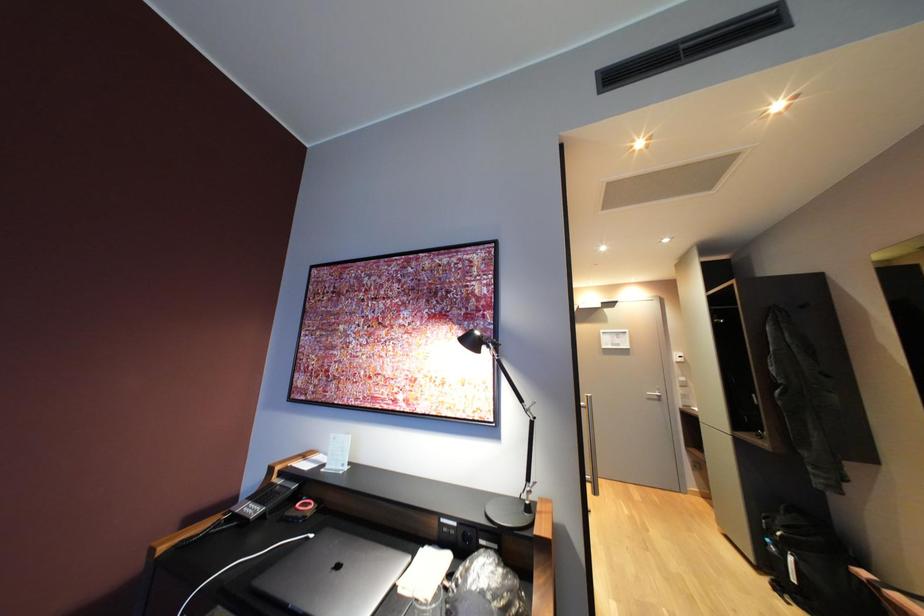
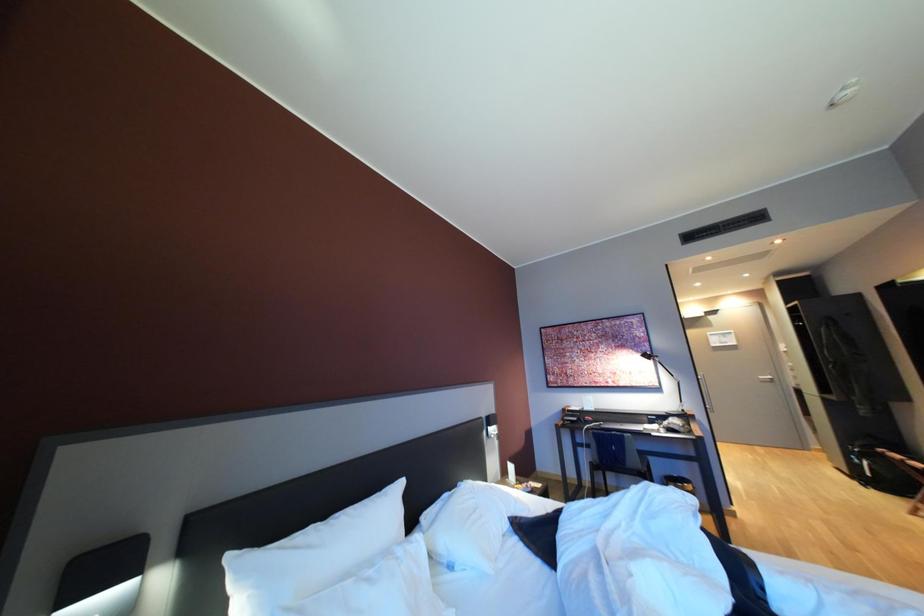
In a continuous first-person perspective shot, in which direction is the camera moving?

The cameraman walked toward left, backward.